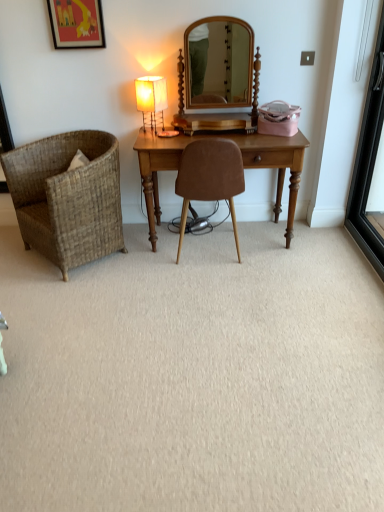
The image size is (384, 512). Identify the location of vacant space in wooden desk at center (from a real-world perspective). (250, 231).